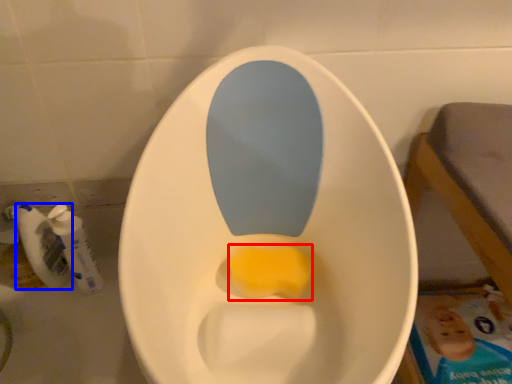
Question: Which object is closer to the camera taking this photo, food (highlighted by a red box) or mouthwash (highlighted by a blue box)?

Choices:
 (A) food
 (B) mouthwash

Answer: (A)